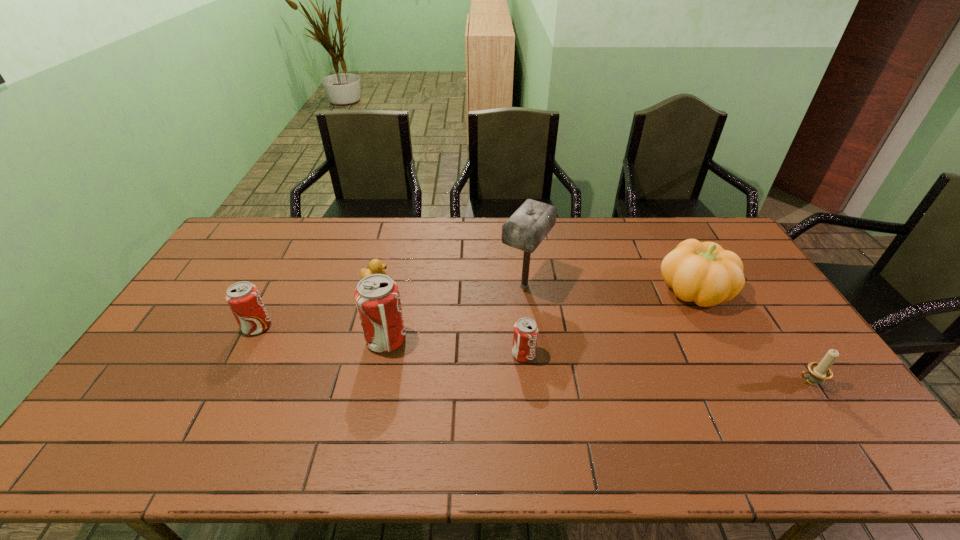
Please point a free position for a soda can on the right. Please provide its 2D coordinates. Your answer should be formatted as a tuple, i.e. [(x, y)], where the tuple contains the x and y coordinates of a point satisfying the conditions above.

[(670, 370)]